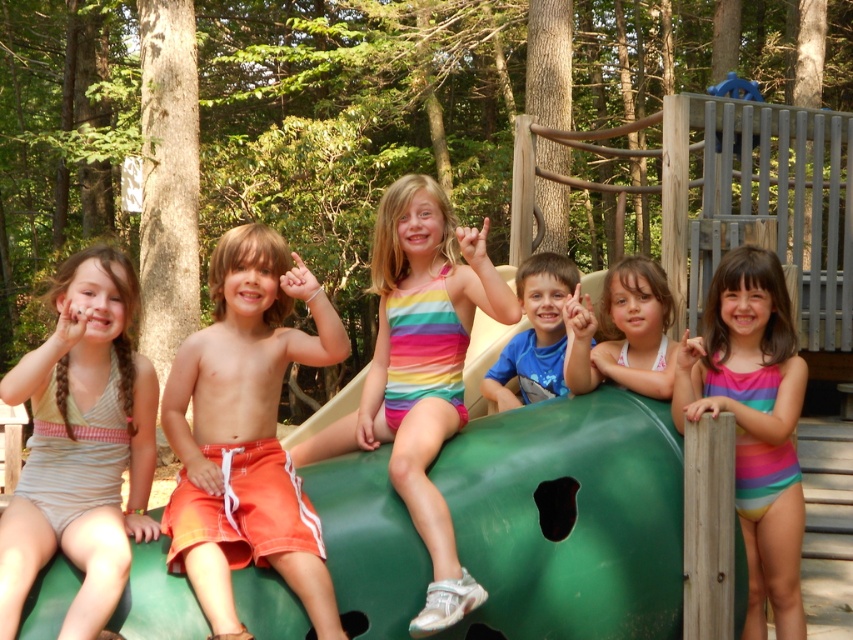
You are a photographer at the playground and want to capture a photo of the orange fabric shorts at center and the pink striped swimsuit at center. Which one should you adjust your camera focus on first if you want to ensure both are in focus, given their positions relative to the camera?

You should focus on the orange fabric shorts at center first because it is closer to the camera than the pink striped swimsuit at center. By focusing on the closer object, the depth of field will naturally include the farther one in focus as well.